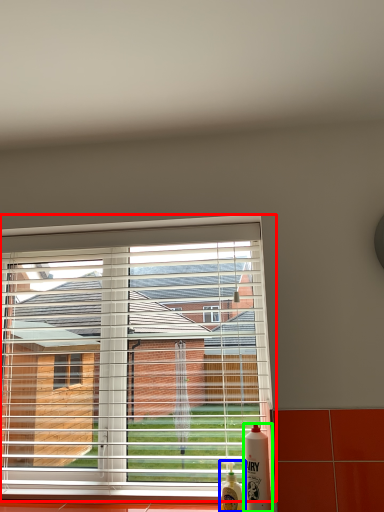
Question: Which is nearer to the window (highlighted by a red box)? bottle (highlighted by a blue box) or bottle (highlighted by a green box).

Choices:
 (A) bottle
 (B) bottle

Answer: (B)